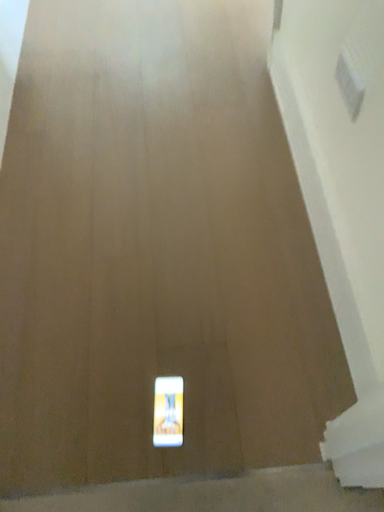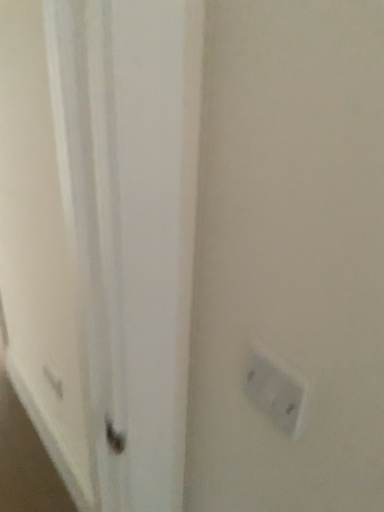
Question: Which way did the camera rotate in the video?

Choices:
 (A) rotated downward
 (B) rotated upward

Answer: (B)